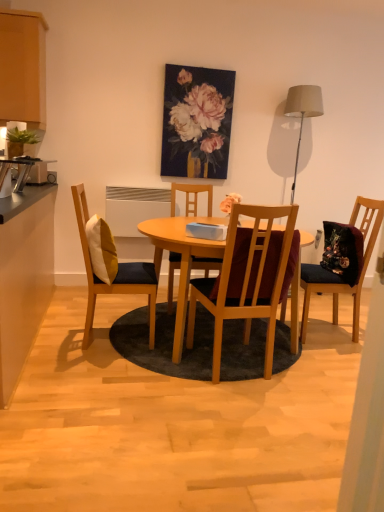
In order to face matte yellow pillow at left, should I rotate leftwards or rightwards?

A 11.823 degree turn to the left will do.

This screenshot has width=384, height=512. I want to click on wooden chair at center, the third chair in the left-to-right sequence, so click(248, 278).

The image size is (384, 512). Find the location of `yellow and white cushioned chair at left, the 4th chair from the right`. yellow and white cushioned chair at left, the 4th chair from the right is located at coordinates (101, 283).

The height and width of the screenshot is (512, 384). Describe the element at coordinates (101, 283) in the screenshot. I see `yellow and white cushioned chair at left, which appears as the 1th chair when viewed from the left` at that location.

What do you see at coordinates (302, 113) in the screenshot? I see `matte beige lampshade at upper right` at bounding box center [302, 113].

What do you see at coordinates (148, 267) in the screenshot?
I see `light wood table at center` at bounding box center [148, 267].

Locate an element on the screen. Image resolution: width=384 pixels, height=512 pixels. white plastic radiator at center is located at coordinates (134, 208).

Which object is closer to the camera, wooden chair at center, which ranks as the 2th chair in right-to-left order, or light wood table at center?

Positioned in front is wooden chair at center, which ranks as the 2th chair in right-to-left order.

Is wooden chair at center, which ranks as the 2th chair in right-to-left order, beside light wood table at center?

wooden chair at center, which ranks as the 2th chair in right-to-left order, is not next to light wood table at center, and they're not touching.

How distant is wooden chair at center, which ranks as the 2th chair in right-to-left order, from light wood table at center?

A distance of 11.54 inches exists between wooden chair at center, which ranks as the 2th chair in right-to-left order, and light wood table at center.

Which of these two, wooden chair at center, which ranks as the 2th chair in right-to-left order, or light wood table at center, is smaller?

wooden chair at center, which ranks as the 2th chair in right-to-left order, is smaller.

Can you confirm if light wood table at center is smaller than matte yellow pillow at left?

Actually, light wood table at center might be larger than matte yellow pillow at left.

From the image's perspective, would you say light wood table at center is shown under matte yellow pillow at left?

Correct, light wood table at center appears lower than matte yellow pillow at left in the image.

From a real-world perspective, who is located lower, light wood table at center or matte yellow pillow at left?

light wood table at center, from a real-world perspective.

Consider the image. Considering the relative sizes of matte beige lampshade at upper right and black laminate countertop at left, which is the 1th cabinetry from bottom to top, in the image provided, is matte beige lampshade at upper right wider than black laminate countertop at left, which is the 1th cabinetry from bottom to top,?

Incorrect, the width of matte beige lampshade at upper right does not surpass that of black laminate countertop at left, which is the 1th cabinetry from bottom to top.

Can you confirm if matte beige lampshade at upper right is positioned to the left of black laminate countertop at left, marked as the 2th cabinetry in a top-to-bottom arrangement?

No, matte beige lampshade at upper right is not to the left of black laminate countertop at left, marked as the 2th cabinetry in a top-to-bottom arrangement.

The height and width of the screenshot is (512, 384). In order to click on the 1st cabinetry counting from the left of the matte beige lampshade at upper right in this screenshot , I will do tap(24, 276).

Is point (302, 113) positioned behind point (3, 298)?

That is True.

How much distance is there between white plastic radiator at center and wooden chair at center, which appears as the second chair when viewed from the left?

A distance of 54.70 centimeters exists between white plastic radiator at center and wooden chair at center, which appears as the second chair when viewed from the left.

Which of these two, white plastic radiator at center or wooden chair at center, which appears as the second chair when viewed from the left, is smaller?

white plastic radiator at center is smaller.

From a real-world perspective, does white plastic radiator at center sit lower than wooden chair at center, which is counted as the third chair, starting from the right?

Actually, white plastic radiator at center is physically above wooden chair at center, which is counted as the third chair, starting from the right, in the real world.

Considering the sizes of wooden chair at center, which is counted as the third chair, starting from the right, and matte wood cabinet at upper left, the 1th cabinetry when ordered from top to bottom, in the image, is wooden chair at center, which is counted as the third chair, starting from the right, wider or thinner than matte wood cabinet at upper left, the 1th cabinetry when ordered from top to bottom,?

Considering their sizes, wooden chair at center, which is counted as the third chair, starting from the right, looks broader than matte wood cabinet at upper left, the 1th cabinetry when ordered from top to bottom.

Considering the positions of objects wooden chair at center, which appears as the second chair when viewed from the left, and matte wood cabinet at upper left, acting as the second cabinetry starting from the bottom, in the image provided, who is more to the left, wooden chair at center, which appears as the second chair when viewed from the left, or matte wood cabinet at upper left, acting as the second cabinetry starting from the bottom,?

From the viewer's perspective, matte wood cabinet at upper left, acting as the second cabinetry starting from the bottom, appears more on the left side.

Is wooden chair at center, which appears as the second chair when viewed from the left, beside matte wood cabinet at upper left, the 1th cabinetry when ordered from top to bottom?

They are not placed beside each other.

Does point (171, 273) come closer to viewer compared to point (19, 101)?

No, (171, 273) is further to viewer.

Considering the positions of objects matte yellow pillow at left and velvet dark blue chair at right, the 4th chair positioned from the left, in the image provided, who is more to the left, matte yellow pillow at left or velvet dark blue chair at right, the 4th chair positioned from the left,?

matte yellow pillow at left is more to the left.

Which object is more forward, matte yellow pillow at left or velvet dark blue chair at right, the 4th chair positioned from the left?

matte yellow pillow at left is in front.

Can we say matte yellow pillow at left lies outside velvet dark blue chair at right, the 4th chair positioned from the left?

That's correct, matte yellow pillow at left is outside of velvet dark blue chair at right, the 4th chair positioned from the left.

Which point is more forward, (106, 230) or (320, 275)?

The point (106, 230) is more forward.

From a real-world perspective, who is located higher, wooden chair at center, which is counted as the third chair, starting from the right, or wooden chair at center, the third chair in the left-to-right sequence?

From a 3D spatial view, wooden chair at center, the third chair in the left-to-right sequence, is above.

Is wooden chair at center, which appears as the second chair when viewed from the left, facing away from wooden chair at center, which ranks as the 2th chair in right-to-left order?

No, wooden chair at center, which ranks as the 2th chair in right-to-left order, is not at the back of wooden chair at center, which appears as the second chair when viewed from the left.

From the image's perspective, which one is positioned lower, wooden chair at center, which is counted as the third chair, starting from the right, or wooden chair at center, the third chair in the left-to-right sequence?

wooden chair at center, the third chair in the left-to-right sequence, from the image's perspective.

Does wooden chair at center, which is counted as the third chair, starting from the right, have a larger size compared to wooden chair at center, which ranks as the 2th chair in right-to-left order?

Actually, wooden chair at center, which is counted as the third chair, starting from the right, might be smaller than wooden chair at center, which ranks as the 2th chair in right-to-left order.

This screenshot has width=384, height=512. I want to click on kitchen & dining room table that is under the wooden chair at center, the third chair in the left-to-right sequence (from a real-world perspective), so click(x=148, y=267).

At what (x,y) coordinates should I click in order to perform the action: click on pillow above the light wood table at center (from a real-world perspective). Please return your answer as a coordinate pair (x, y). Image resolution: width=384 pixels, height=512 pixels. Looking at the image, I should click on (101, 249).

Looking at the image, which one is located further to yellow and white cushioned chair at left, the 4th chair from the right, white plastic radiator at center or light wood table at center?

white plastic radiator at center is positioned further to the anchor yellow and white cushioned chair at left, the 4th chair from the right.

From the image, which object appears to be farther from yellow and white cushioned chair at left, the 4th chair from the right, black laminate countertop at left, marked as the 2th cabinetry in a top-to-bottom arrangement, or light wood table at center?

black laminate countertop at left, marked as the 2th cabinetry in a top-to-bottom arrangement, lies further to yellow and white cushioned chair at left, the 4th chair from the right, than the other object.

Considering their positions, is yellow and white cushioned chair at left, which appears as the 1th chair when viewed from the left, positioned further to wooden chair at center, which appears as the second chair when viewed from the left, than wooden chair at center, which ranks as the 2th chair in right-to-left order?

yellow and white cushioned chair at left, which appears as the 1th chair when viewed from the left.

Which object lies further to the anchor point matte yellow pillow at left, velvet dark blue chair at right, placed as the first chair when sorted from right to left, or black laminate countertop at left, which is the 1th cabinetry from bottom to top?

velvet dark blue chair at right, placed as the first chair when sorted from right to left.

When comparing their distances from matte yellow pillow at left, does velvet dark blue chair at right, the 4th chair positioned from the left, or yellow and white cushioned chair at left, which appears as the 1th chair when viewed from the left, seem closer?

yellow and white cushioned chair at left, which appears as the 1th chair when viewed from the left, is positioned closer to the anchor matte yellow pillow at left.

Based on their spatial positions, is matte wood cabinet at upper left, the 1th cabinetry when ordered from top to bottom, or black laminate countertop at left, marked as the 2th cabinetry in a top-to-bottom arrangement, further from oil paint canvas at upper center?

Among the two, black laminate countertop at left, marked as the 2th cabinetry in a top-to-bottom arrangement, is located further to oil paint canvas at upper center.

When comparing their distances from velvet dark blue chair at right, the 4th chair positioned from the left, does matte yellow pillow at left or matte beige lampshade at upper right seem closer?

matte beige lampshade at upper right is positioned closer to the anchor velvet dark blue chair at right, the 4th chair positioned from the left.

Looking at the image, which one is located closer to velvet dark blue chair at right, placed as the first chair when sorted from right to left, matte yellow pillow at left or light wood table at center?

light wood table at center is closer to velvet dark blue chair at right, placed as the first chair when sorted from right to left.

Locate an element on the screen. picture frame positioned between matte yellow pillow at left and white plastic radiator at center from near to far is located at coordinates (196, 122).

This screenshot has width=384, height=512. I want to click on appliance that lies between oil paint canvas at upper center and wooden chair at center, which is counted as the third chair, starting from the right, from top to bottom, so click(x=134, y=208).

Locate an element on the screen. Image resolution: width=384 pixels, height=512 pixels. pillow between black laminate countertop at left, which is the 1th cabinetry from bottom to top, and white plastic radiator at center from front to back is located at coordinates (101, 249).

Identify the location of picture frame between black laminate countertop at left, which is the 1th cabinetry from bottom to top, and matte beige lampshade at upper right. Image resolution: width=384 pixels, height=512 pixels. (196, 122).